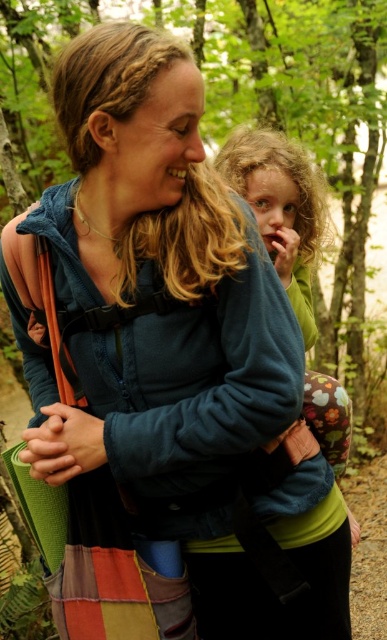
Does point (309, 284) come closer to viewer compared to point (275, 221)?

No, (309, 284) is further to viewer.

Who is higher up, fluffy green sweater at center or curly blonde hair at upper center?

curly blonde hair at upper center is higher up.

The image size is (387, 640). Identify the location of fluffy green sweater at center. (280, 209).